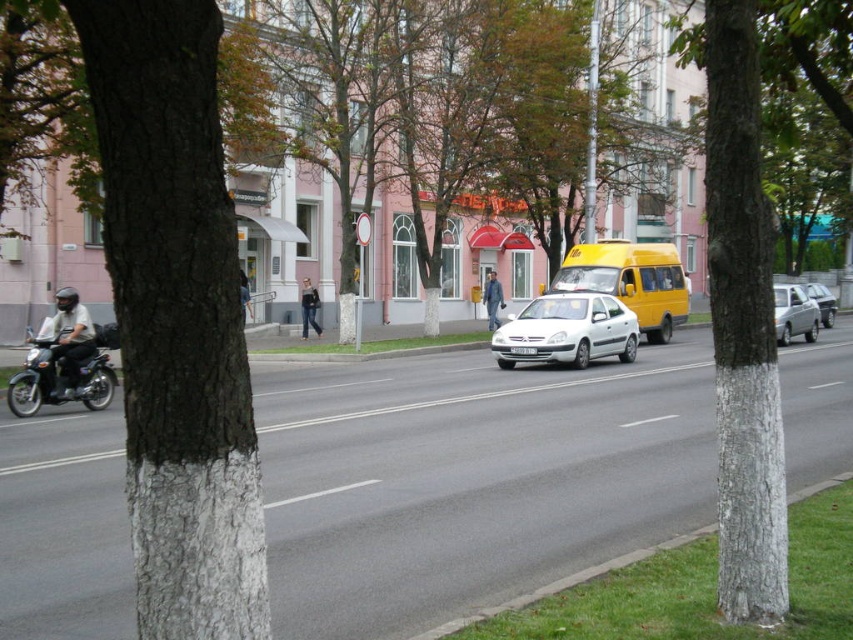
Question: Which of the following is the closest to the observer?

Choices:
 (A) smooth bark tree at left
 (B) yellow matte van at center
 (C) white matte car at center

Answer: (A)

Question: Can you confirm if shiny black motorcycle at left is positioned below silver metallic sedan at center?

Choices:
 (A) no
 (B) yes

Answer: (B)

Question: Which of the following is the farthest from the observer?

Choices:
 (A) (306, 323)
 (B) (822, 291)

Answer: (B)

Question: Which object appears farthest from the camera in this image?

Choices:
 (A) shiny black motorcycle at left
 (B) silver metallic sedan at center
 (C) blue denim jacket at center

Answer: (B)

Question: In this image, where is smooth bark tree at left located relative to blue denim jacket at center?

Choices:
 (A) left
 (B) right

Answer: (A)

Question: Is denim jeans at center bigger than silver metallic sedan at center?

Choices:
 (A) yes
 (B) no

Answer: (B)